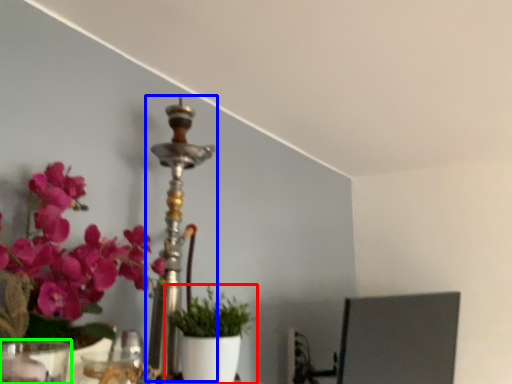
Question: Estimate the real-world distances between objects in this image. Which object is farther from houseplant (highlighted by a red box), candle holder (highlighted by a blue box) or vase (highlighted by a green box)?

Choices:
 (A) candle holder
 (B) vase

Answer: (B)